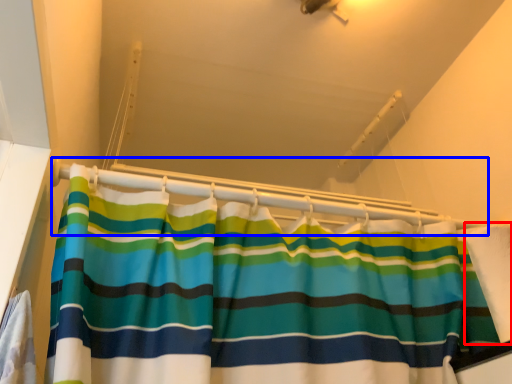
Question: Which object appears closest to the camera in this image, fabric (highlighted by a red box) or balustrade (highlighted by a blue box)?

Choices:
 (A) fabric
 (B) balustrade

Answer: (A)